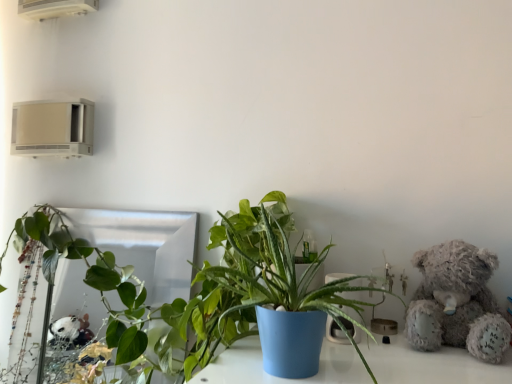
Identify the location of beige plastic air conditioner at upper left, which is the 1th air conditioning in bottom-to-top order. This screenshot has width=512, height=384. (52, 128).

The width and height of the screenshot is (512, 384). What do you see at coordinates (52, 128) in the screenshot?
I see `beige plastic air conditioner at upper left, the second air conditioning viewed from the top` at bounding box center [52, 128].

In order to face fluffy gray teddy bear at right, should I rotate leftwards or rightwards?

A 25.178 degree turn to the right will do.

This screenshot has width=512, height=384. Describe the element at coordinates (55, 8) in the screenshot. I see `white plastic air conditioner at upper left, marked as the 2th air conditioning in a bottom-to-top arrangement` at that location.

Find the location of `beige plastic air conditioner at upper left, which is the 1th air conditioning in bottom-to-top order`. beige plastic air conditioner at upper left, which is the 1th air conditioning in bottom-to-top order is located at coordinates (52, 128).

There is a fluffy gray teddy bear at right. Find the location of `houseplant above it (from a real-world perspective)`. houseplant above it (from a real-world perspective) is located at coordinates (134, 289).

Who is shorter, fluffy gray teddy bear at right or green leafy plant at center, the 1th houseplant positioned from the front?

fluffy gray teddy bear at right.

Is fluffy gray teddy bear at right oriented away from green leafy plant at center, placed as the second houseplant when sorted from left to right?

No, fluffy gray teddy bear at right's orientation is not away from green leafy plant at center, placed as the second houseplant when sorted from left to right.

How different are the orientations of beige plastic air conditioner at upper left, which is the 1th air conditioning in bottom-to-top order, and fluffy gray teddy bear at right in degrees?

The angular difference between beige plastic air conditioner at upper left, which is the 1th air conditioning in bottom-to-top order, and fluffy gray teddy bear at right is 12.3 degrees.

Looking at the image, does beige plastic air conditioner at upper left, the second air conditioning viewed from the top, seem bigger or smaller compared to fluffy gray teddy bear at right?

Clearly, beige plastic air conditioner at upper left, the second air conditioning viewed from the top, is smaller in size than fluffy gray teddy bear at right.

From a real-world perspective, is beige plastic air conditioner at upper left, the second air conditioning viewed from the top, physically above fluffy gray teddy bear at right?

Yes, from a real-world perspective, beige plastic air conditioner at upper left, the second air conditioning viewed from the top, is above fluffy gray teddy bear at right.

Is white plastic air conditioner at upper left, which ranks as the 1th air conditioning in top-to-bottom order, oriented towards green leafy plant at center, acting as the 2th houseplant starting from the back?

No, white plastic air conditioner at upper left, which ranks as the 1th air conditioning in top-to-bottom order, is not facing towards green leafy plant at center, acting as the 2th houseplant starting from the back.

Between white plastic air conditioner at upper left, marked as the 2th air conditioning in a bottom-to-top arrangement, and green leafy plant at center, placed as the second houseplant when sorted from left to right, which one has less height?

With less height is white plastic air conditioner at upper left, marked as the 2th air conditioning in a bottom-to-top arrangement.

How distant is white plastic air conditioner at upper left, marked as the 2th air conditioning in a bottom-to-top arrangement, from green leafy plant at center, acting as the 2th houseplant starting from the back?

They are 74.88 centimeters apart.

Is white plastic air conditioner at upper left, which ranks as the 1th air conditioning in top-to-bottom order, positioned far away from green leafy plant at center, acting as the 2th houseplant starting from the back?

white plastic air conditioner at upper left, which ranks as the 1th air conditioning in top-to-bottom order, is near green leafy plant at center, acting as the 2th houseplant starting from the back, not far away.

Is white plastic air conditioner at upper left, marked as the 2th air conditioning in a bottom-to-top arrangement, surrounded by green glossy plant at left, which appears as the 2th houseplant when viewed from the front?

That's incorrect, white plastic air conditioner at upper left, marked as the 2th air conditioning in a bottom-to-top arrangement, is not inside green glossy plant at left, which appears as the 2th houseplant when viewed from the front.

I want to click on the 1st air conditioning counting from the left side of the green glossy plant at left, which is counted as the first houseplant, starting from the back, so click(55, 8).

Which is behind, green glossy plant at left, which is counted as the first houseplant, starting from the back, or white plastic air conditioner at upper left, marked as the 2th air conditioning in a bottom-to-top arrangement?

white plastic air conditioner at upper left, marked as the 2th air conditioning in a bottom-to-top arrangement.

From a real-world perspective, is green glossy plant at left, the 2th houseplant from the right, physically located above or below white plastic air conditioner at upper left, which ranks as the 1th air conditioning in top-to-bottom order?

From a real-world perspective, green glossy plant at left, the 2th houseplant from the right, is physically below white plastic air conditioner at upper left, which ranks as the 1th air conditioning in top-to-bottom order.

Looking at this image, do you think green glossy plant at left, the 2th houseplant from the right, is within beige plastic air conditioner at upper left, which is the 1th air conditioning in bottom-to-top order, or outside of it?

green glossy plant at left, the 2th houseplant from the right, is outside beige plastic air conditioner at upper left, which is the 1th air conditioning in bottom-to-top order.

Is green glossy plant at left, which is counted as the first houseplant, starting from the back, smaller than beige plastic air conditioner at upper left, which is the 1th air conditioning in bottom-to-top order?

Actually, green glossy plant at left, which is counted as the first houseplant, starting from the back, might be larger than beige plastic air conditioner at upper left, which is the 1th air conditioning in bottom-to-top order.

Identify the location of the 1st air conditioning behind the green glossy plant at left, which is counted as the first houseplant, starting from the back, counting from the anchor's position. This screenshot has width=512, height=384. pyautogui.click(x=52, y=128).

Which is in front, green glossy plant at left, which appears as the 2th houseplant when viewed from the front, or beige plastic air conditioner at upper left, which is the 1th air conditioning in bottom-to-top order?

Positioned in front is green glossy plant at left, which appears as the 2th houseplant when viewed from the front.

Does beige plastic air conditioner at upper left, which is the 1th air conditioning in bottom-to-top order, appear on the left side of white plastic air conditioner at upper left, marked as the 2th air conditioning in a bottom-to-top arrangement?

Correct, you'll find beige plastic air conditioner at upper left, which is the 1th air conditioning in bottom-to-top order, to the left of white plastic air conditioner at upper left, marked as the 2th air conditioning in a bottom-to-top arrangement.

Considering the points (27, 155) and (82, 5), which point is behind, point (27, 155) or point (82, 5)?

The point (27, 155) is farther from the camera.

Based on the photo, which object is thinner, beige plastic air conditioner at upper left, which is the 1th air conditioning in bottom-to-top order, or white plastic air conditioner at upper left, marked as the 2th air conditioning in a bottom-to-top arrangement?

white plastic air conditioner at upper left, marked as the 2th air conditioning in a bottom-to-top arrangement.

Looking at this image, considering the sizes of green glossy plant at left, which appears as the 2th houseplant when viewed from the front, and fluffy gray teddy bear at right in the image, is green glossy plant at left, which appears as the 2th houseplant when viewed from the front, taller or shorter than fluffy gray teddy bear at right?

In the image, green glossy plant at left, which appears as the 2th houseplant when viewed from the front, appears to be taller than fluffy gray teddy bear at right.

From a real-world perspective, is green glossy plant at left, which appears as the 2th houseplant when viewed from the front, below fluffy gray teddy bear at right?

Indeed, from a real-world perspective, green glossy plant at left, which appears as the 2th houseplant when viewed from the front, is positioned beneath fluffy gray teddy bear at right.

Is green glossy plant at left, which appears as the 2th houseplant when viewed from the front, bigger than fluffy gray teddy bear at right?

Yes, green glossy plant at left, which appears as the 2th houseplant when viewed from the front, is bigger than fluffy gray teddy bear at right.

Where is `houseplant lying above the fluffy gray teddy bear at right (from the image's perspective)`? houseplant lying above the fluffy gray teddy bear at right (from the image's perspective) is located at coordinates (134, 289).

From a real-world perspective, starting from the fluffy gray teddy bear at right, which air conditioning is the 1st one vertically above it? Please provide its 2D coordinates.

[(52, 128)]

Looking at the image, which one is located closer to green leafy plant at center, acting as the 2th houseplant starting from the back, green glossy plant at left, which is counted as the first houseplant, starting from the back, or beige plastic air conditioner at upper left, which is the 1th air conditioning in bottom-to-top order?

Among the two, green glossy plant at left, which is counted as the first houseplant, starting from the back, is located nearer to green leafy plant at center, acting as the 2th houseplant starting from the back.

Which object lies nearer to the anchor point beige plastic air conditioner at upper left, which is the 1th air conditioning in bottom-to-top order, green leafy plant at center, the 1th houseplant positioned from the front, or green glossy plant at left, arranged as the first houseplant when viewed from the left?

The object closer to beige plastic air conditioner at upper left, which is the 1th air conditioning in bottom-to-top order, is green glossy plant at left, arranged as the first houseplant when viewed from the left.

Which object lies further to the anchor point green glossy plant at left, which is counted as the first houseplant, starting from the back, beige plastic air conditioner at upper left, the second air conditioning viewed from the top, or white plastic air conditioner at upper left, which ranks as the 1th air conditioning in top-to-bottom order?

The object further to green glossy plant at left, which is counted as the first houseplant, starting from the back, is white plastic air conditioner at upper left, which ranks as the 1th air conditioning in top-to-bottom order.

Estimate the real-world distances between objects in this image. Which object is closer to green leafy plant at center, placed as the second houseplant when sorted from left to right, beige plastic air conditioner at upper left, the second air conditioning viewed from the top, or white plastic air conditioner at upper left, which ranks as the 1th air conditioning in top-to-bottom order?

beige plastic air conditioner at upper left, the second air conditioning viewed from the top, lies closer to green leafy plant at center, placed as the second houseplant when sorted from left to right, than the other object.

Considering their positions, is beige plastic air conditioner at upper left, the second air conditioning viewed from the top, positioned closer to fluffy gray teddy bear at right than white plastic air conditioner at upper left, marked as the 2th air conditioning in a bottom-to-top arrangement?

beige plastic air conditioner at upper left, the second air conditioning viewed from the top, lies closer to fluffy gray teddy bear at right than the other object.

When comparing their distances from white plastic air conditioner at upper left, which ranks as the 1th air conditioning in top-to-bottom order, does green leafy plant at center, which is counted as the first houseplant, starting from the right, or fluffy gray teddy bear at right seem closer?

green leafy plant at center, which is counted as the first houseplant, starting from the right, is positioned closer to the anchor white plastic air conditioner at upper left, which ranks as the 1th air conditioning in top-to-bottom order.

Based on their spatial positions, is fluffy gray teddy bear at right or green glossy plant at left, the 2th houseplant from the right, further from white plastic air conditioner at upper left, which ranks as the 1th air conditioning in top-to-bottom order?

The object further to white plastic air conditioner at upper left, which ranks as the 1th air conditioning in top-to-bottom order, is fluffy gray teddy bear at right.

Considering their positions, is fluffy gray teddy bear at right positioned further to green leafy plant at center, placed as the second houseplant when sorted from left to right, than white plastic air conditioner at upper left, marked as the 2th air conditioning in a bottom-to-top arrangement?

Based on the image, white plastic air conditioner at upper left, marked as the 2th air conditioning in a bottom-to-top arrangement, appears to be further to green leafy plant at center, placed as the second houseplant when sorted from left to right.

You are a GUI agent. You are given a task and a screenshot of the screen. Output one action in this format:
    pyautogui.click(x=<x>, y=<y>)
    Task: Click on the houseplant between beige plastic air conditioner at upper left, the second air conditioning viewed from the top, and green leafy plant at center, the 1th houseplant positioned from the front
    Image resolution: width=512 pixels, height=384 pixels.
    Given the screenshot: What is the action you would take?
    pyautogui.click(x=96, y=273)

The height and width of the screenshot is (384, 512). Identify the location of houseplant between green glossy plant at left, which is counted as the first houseplant, starting from the back, and fluffy gray teddy bear at right from left to right. (134, 289).

Identify the location of houseplant between white plastic air conditioner at upper left, which ranks as the 1th air conditioning in top-to-bottom order, and green glossy plant at left, which appears as the 2th houseplant when viewed from the front, in the vertical direction. The image size is (512, 384). (134, 289).

Where is `air conditioning between beige plastic air conditioner at upper left, which is the 1th air conditioning in bottom-to-top order, and fluffy gray teddy bear at right from left to right`? Image resolution: width=512 pixels, height=384 pixels. air conditioning between beige plastic air conditioner at upper left, which is the 1th air conditioning in bottom-to-top order, and fluffy gray teddy bear at right from left to right is located at coordinates (55, 8).